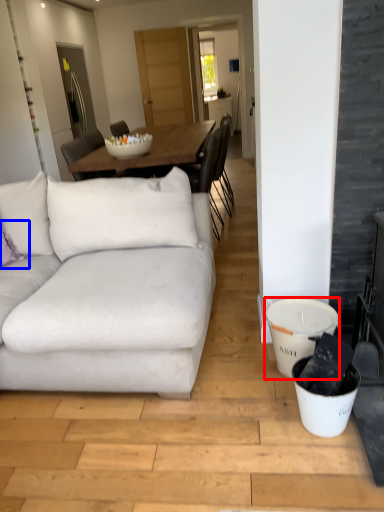
Question: Which object is closer to the camera taking this photo, bucket (highlighted by a red box) or pillow (highlighted by a blue box)?

Choices:
 (A) bucket
 (B) pillow

Answer: (A)